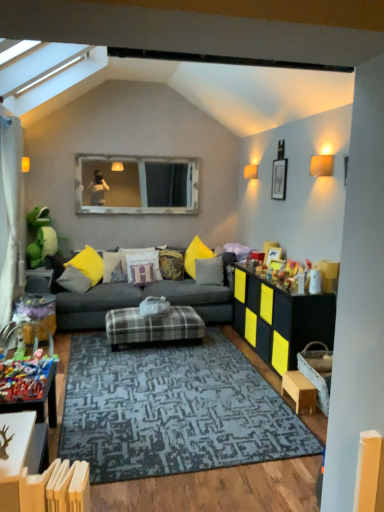
Question: Does textured yellow pillow at center, positioned as the 5th pillow in left-to-right order, appear on the left side of yellow fabric pillow at center, acting as the sixth pillow starting from the right?

Choices:
 (A) yes
 (B) no

Answer: (B)

Question: Can you confirm if textured yellow pillow at center, which is counted as the second pillow, starting from the right, is positioned to the right of yellow fabric pillow at center, acting as the sixth pillow starting from the right?

Choices:
 (A) yes
 (B) no

Answer: (A)

Question: Is textured yellow pillow at center, positioned as the 5th pillow in left-to-right order, further to camera compared to yellow fabric pillow at center, acting as the sixth pillow starting from the right?

Choices:
 (A) no
 (B) yes

Answer: (B)

Question: Is textured yellow pillow at center, which is counted as the second pillow, starting from the right, next to yellow fabric pillow at center, the first pillow when ordered from left to right?

Choices:
 (A) no
 (B) yes

Answer: (A)

Question: Would you say textured yellow pillow at center, which is counted as the second pillow, starting from the right, is outside yellow fabric pillow at center, the first pillow when ordered from left to right?

Choices:
 (A) no
 (B) yes

Answer: (B)

Question: From the image's perspective, does textured yellow pillow at center, which is counted as the second pillow, starting from the right, appear higher than yellow fabric pillow at center, the first pillow when ordered from left to right?

Choices:
 (A) yes
 (B) no

Answer: (A)

Question: Can you confirm if plastic toy at lower left, placed as the 1th toy when sorted from right to left, is wider than velvet yellow pillow at center, acting as the fifth pillow starting from the right?

Choices:
 (A) no
 (B) yes

Answer: (B)

Question: Is velvet yellow pillow at center, the 2th pillow viewed from the left, surrounded by plastic toy at lower left, which is the second toy in left-to-right order?

Choices:
 (A) yes
 (B) no

Answer: (B)

Question: Is plastic toy at lower left, the second toy viewed from the back, positioned beyond the bounds of velvet yellow pillow at center, the 2th pillow viewed from the left?

Choices:
 (A) no
 (B) yes

Answer: (B)

Question: From a real-world perspective, is plastic toy at lower left, which is the second toy from top to bottom, under velvet yellow pillow at center, acting as the fifth pillow starting from the right?

Choices:
 (A) no
 (B) yes

Answer: (B)

Question: Is plastic toy at lower left, placed as the 1th toy when sorted from right to left, positioned behind velvet yellow pillow at center, the 2th pillow viewed from the left?

Choices:
 (A) no
 (B) yes

Answer: (A)

Question: Can you confirm if plastic toy at lower left, the 1th toy positioned from the bottom, is shorter than velvet yellow pillow at center, the 2th pillow viewed from the left?

Choices:
 (A) no
 (B) yes

Answer: (B)

Question: Can you confirm if wooden table at lower left, positioned as the 1th table in front-to-back order, is shorter than matte black cabinet at right, which appears as the 4th table when viewed from the left?

Choices:
 (A) no
 (B) yes

Answer: (B)